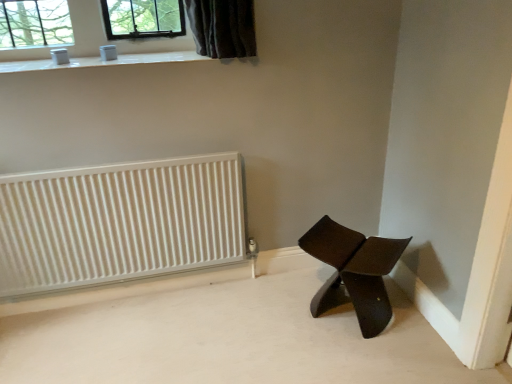
I want to click on matte brown chair at lower right, so click(x=354, y=271).

Find the location of a particular element. Image resolution: width=512 pixels, height=384 pixels. white glossy window sill at upper center is located at coordinates (101, 61).

You are a GUI agent. You are given a task and a screenshot of the screen. Output one action in this format:
    pyautogui.click(x=<x>, y=<y>)
    Task: Click on the matte brown chair at lower right
    This screenshot has height=384, width=512.
    Given the screenshot: What is the action you would take?
    pyautogui.click(x=354, y=271)

Which of these two, matte brown chair at lower right or white glossy window sill at upper center, is smaller?

white glossy window sill at upper center.

Is matte brown chair at lower right far from white glossy window sill at upper center?

Yes, matte brown chair at lower right and white glossy window sill at upper center are quite far apart.

Which object is further away from the camera, matte brown chair at lower right or white glossy window sill at upper center?

white glossy window sill at upper center is further away from the camera.

How much distance is there between white ribbed radiator at left and matte brown chair at lower right?

white ribbed radiator at left and matte brown chair at lower right are 28.30 inches apart from each other.

Is white ribbed radiator at left aimed at matte brown chair at lower right?

No, white ribbed radiator at left is not oriented towards matte brown chair at lower right.

From a real-world perspective, is white ribbed radiator at left below matte brown chair at lower right?

No, from a real-world perspective, white ribbed radiator at left is not under matte brown chair at lower right.

In terms of height, does white ribbed radiator at left look taller or shorter compared to matte brown chair at lower right?

In the image, white ribbed radiator at left appears to be taller than matte brown chair at lower right.

Measure the distance from matte brown chair at lower right to white ribbed radiator at left.

Result: matte brown chair at lower right is 28.30 inches from white ribbed radiator at left.

In the image, is matte brown chair at lower right positioned in front of or behind white ribbed radiator at left?

Visually, matte brown chair at lower right is located in front of white ribbed radiator at left.

From a real-world perspective, which object rests below the other?

matte brown chair at lower right, from a real-world perspective.

Looking at this image, from the image's perspective, is matte brown chair at lower right located above white ribbed radiator at left?

Actually, matte brown chair at lower right appears below white ribbed radiator at left in the image.

Between white glossy window sill at upper center and matte brown chair at lower right, which one appears on the right side from the viewer's perspective?

matte brown chair at lower right.

From a real-world perspective, between white glossy window sill at upper center and matte brown chair at lower right, who is vertically higher?

From a 3D spatial view, white glossy window sill at upper center is above.

In the scene shown: Does white glossy window sill at upper center have a lesser width compared to matte brown chair at lower right?

Incorrect, the width of white glossy window sill at upper center is not less than that of matte brown chair at lower right.

Between white glossy window sill at upper center and matte brown chair at lower right, which one has smaller size?

Smaller between the two is white glossy window sill at upper center.

Which object is more forward, white ribbed radiator at left or white glossy window sill at upper center?

Positioned in front is white glossy window sill at upper center.

From the picture: Between white ribbed radiator at left and white glossy window sill at upper center, which one has smaller width?

With smaller width is white ribbed radiator at left.

Is the surface of white glossy window sill at upper center in direct contact with white ribbed radiator at left?

white glossy window sill at upper center and white ribbed radiator at left are not in contact.

Considering the relative positions of white glossy window sill at upper center and white ribbed radiator at left in the image provided, is white glossy window sill at upper center in front of white ribbed radiator at left?

Yes, white glossy window sill at upper center is in front of white ribbed radiator at left.

In terms of width, does white glossy window sill at upper center look wider or thinner when compared to white ribbed radiator at left?

In the image, white glossy window sill at upper center appears to be wider than white ribbed radiator at left.

From a real-world perspective, relative to white ribbed radiator at left, is white glossy window sill at upper center vertically above or below?

Clearly, from a real-world perspective, white glossy window sill at upper center is above white ribbed radiator at left.

Where is `chair lying below the white glossy window sill at upper center (from the image's perspective)`? The height and width of the screenshot is (384, 512). chair lying below the white glossy window sill at upper center (from the image's perspective) is located at coordinates (354, 271).

Image resolution: width=512 pixels, height=384 pixels. What are the coordinates of `radiator lying on the left of matte brown chair at lower right` in the screenshot? It's located at (119, 223).

Looking at the image, which one is located further to matte brown chair at lower right, white ribbed radiator at left or white glossy window sill at upper center?

white glossy window sill at upper center.

Estimate the real-world distances between objects in this image. Which object is further from matte brown chair at lower right, white glossy window sill at upper center or white ribbed radiator at left?

white glossy window sill at upper center is positioned further to the anchor matte brown chair at lower right.

When comparing their distances from white ribbed radiator at left, does white glossy window sill at upper center or matte brown chair at lower right seem closer?

white glossy window sill at upper center.

Considering their positions, is matte brown chair at lower right positioned further to white glossy window sill at upper center than white ribbed radiator at left?

matte brown chair at lower right is positioned further to the anchor white glossy window sill at upper center.

From the image, which object appears to be nearer to white ribbed radiator at left, matte brown chair at lower right or white glossy window sill at upper center?

Among the two, white glossy window sill at upper center is located nearer to white ribbed radiator at left.

Estimate the real-world distances between objects in this image. Which object is closer to white glossy window sill at upper center, white ribbed radiator at left or matte brown chair at lower right?

The object closer to white glossy window sill at upper center is white ribbed radiator at left.

Image resolution: width=512 pixels, height=384 pixels. Find the location of `window sill between white ribbed radiator at left and matte brown chair at lower right`. window sill between white ribbed radiator at left and matte brown chair at lower right is located at coordinates (101, 61).